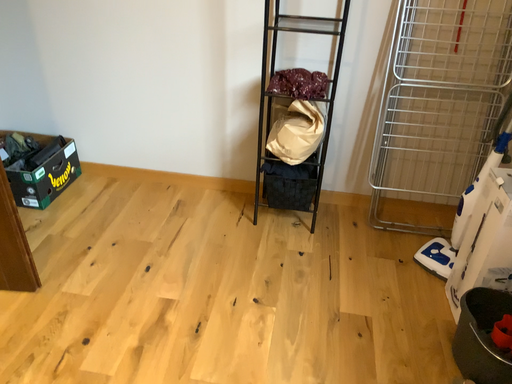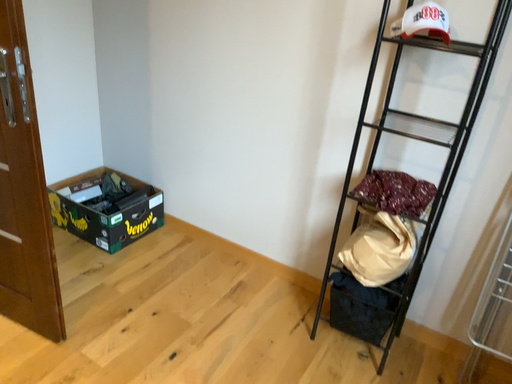
Question: How did the camera likely rotate when shooting the video?

Choices:
 (A) rotated right
 (B) rotated left

Answer: (B)